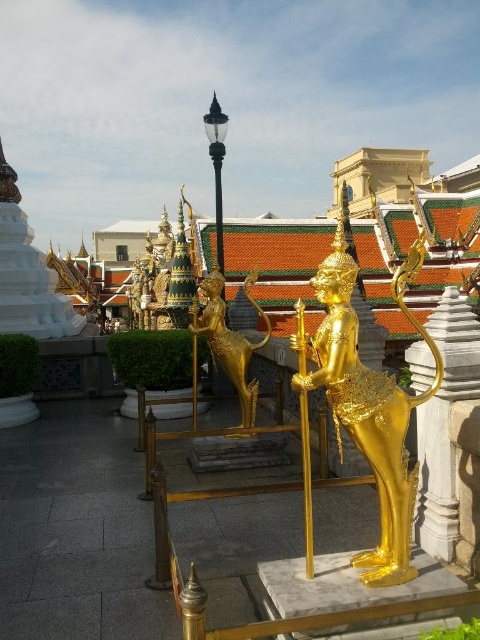
Question: Which of the following is the closest to the observer?

Choices:
 (A) (x=222, y=355)
 (B) (x=420, y=416)
 (C) (x=404, y=538)

Answer: (C)

Question: Observing the image, what is the correct spatial positioning of gold polished statue at center in reference to gold metallic statue at center?

Choices:
 (A) above
 (B) below

Answer: (A)

Question: Does gold polished statue at center have a greater width compared to white stone pillar at right?

Choices:
 (A) no
 (B) yes

Answer: (B)

Question: Which of the following is the farthest from the observer?

Choices:
 (A) pyautogui.click(x=193, y=326)
 (B) pyautogui.click(x=417, y=342)
 (C) pyautogui.click(x=343, y=403)

Answer: (A)

Question: Does gold polished statue at center lie behind gold metallic statue at center?

Choices:
 (A) no
 (B) yes

Answer: (A)

Question: Which object appears closest to the camera in this image?

Choices:
 (A) gold polished statue at center
 (B) white stone pillar at right

Answer: (A)